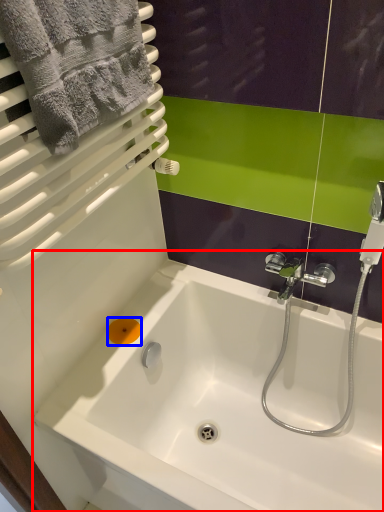
Question: Which point is further to the camera, bathtub (highlighted by a red box) or soap (highlighted by a blue box)?

Choices:
 (A) bathtub
 (B) soap

Answer: (B)